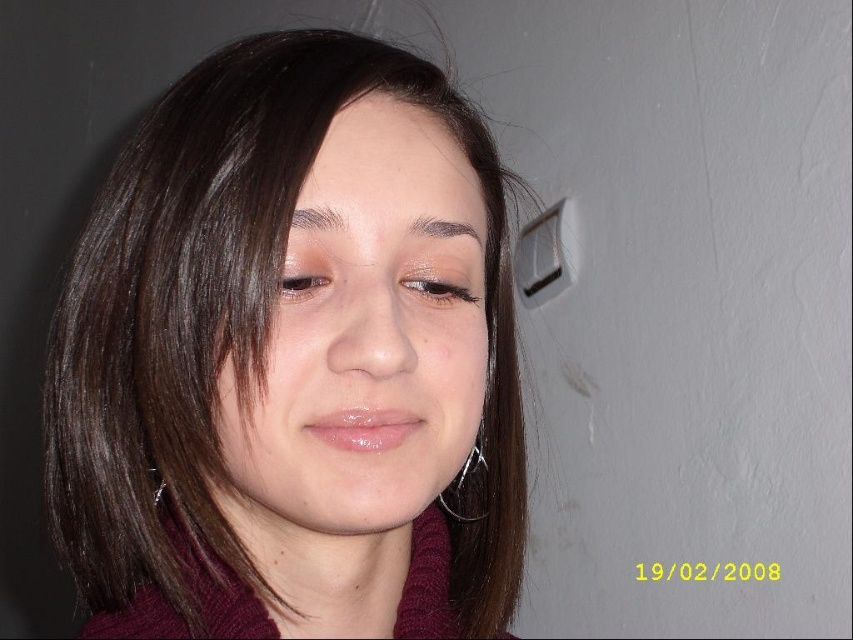
You are a photographer trying to position a subject for a portrait. The subject is currently standing at the point marked by the coordinate point at point (442, 296). You want to place a small accent light 14.48 inches away from the subject. Where should you position the light relative to the subject?

You should position the accent light 14.48 inches away from the subject at the point marked by the coordinate point at point (442, 296) since they are 14.48 inches apart.

You are an artist trying to sketch this person. You notice the smooth skin face at center and the brown glossy eye at upper left. Which object is closer to you, the observer?

The smooth skin face at center is closer to you because it is in front of the brown glossy eye at upper left.